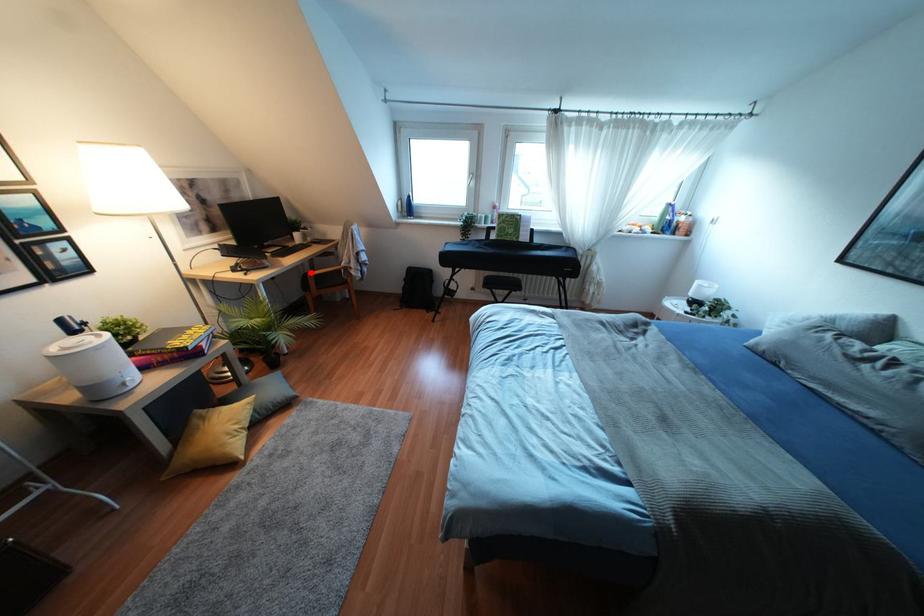
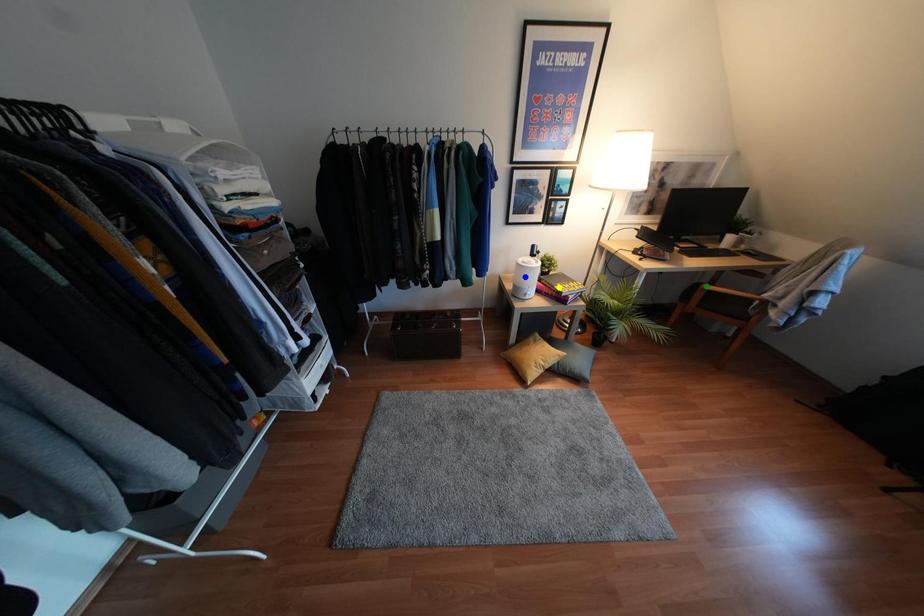
Question: I am providing you with two images of the same scene from different viewpoints. A red point is marked on the first image. You are given multiple points on the second image. Can you choose the point in image 2 that corresponds to the point in image 1?

Choices:
 (A) blue point
 (B) green point
 (C) yellow point

Answer: (B)